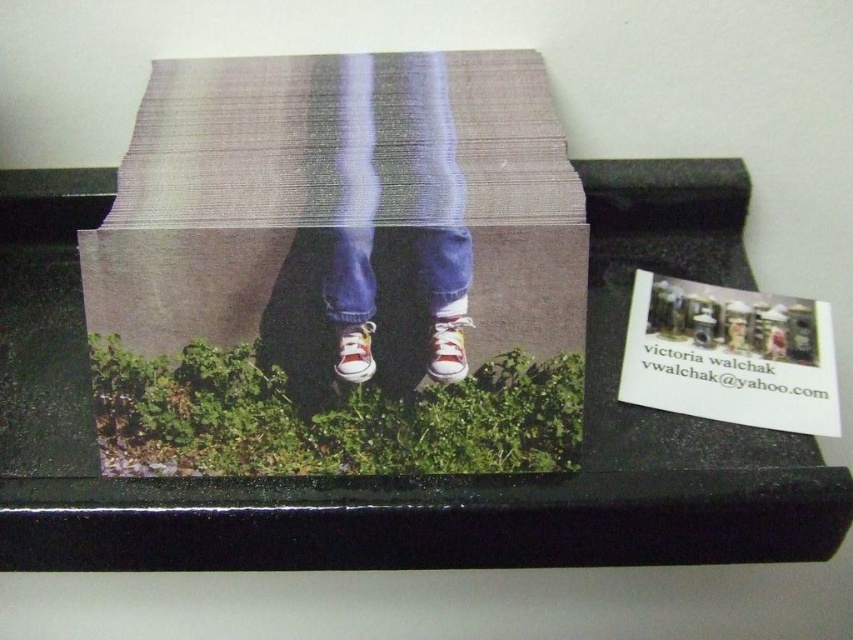
Question: Does matte cardboard box at center appear over matte canvas pants at center?

Choices:
 (A) yes
 (B) no

Answer: (A)

Question: Does matte canvas pants at center appear on the right side of red canvas shoe at center?

Choices:
 (A) yes
 (B) no

Answer: (A)

Question: Which of these objects is positioned farthest from the white canvas shoe at center?

Choices:
 (A) red canvas shoe at center
 (B) matte canvas pants at center

Answer: (B)

Question: Which object is closer to the camera taking this photo?

Choices:
 (A) white canvas shoe at center
 (B) black glossy ledge at center

Answer: (B)

Question: Is black glossy ledge at center above matte cardboard box at center?

Choices:
 (A) yes
 (B) no

Answer: (B)

Question: Which point is closer to the camera?

Choices:
 (A) black glossy ledge at center
 (B) matte canvas pants at center

Answer: (A)